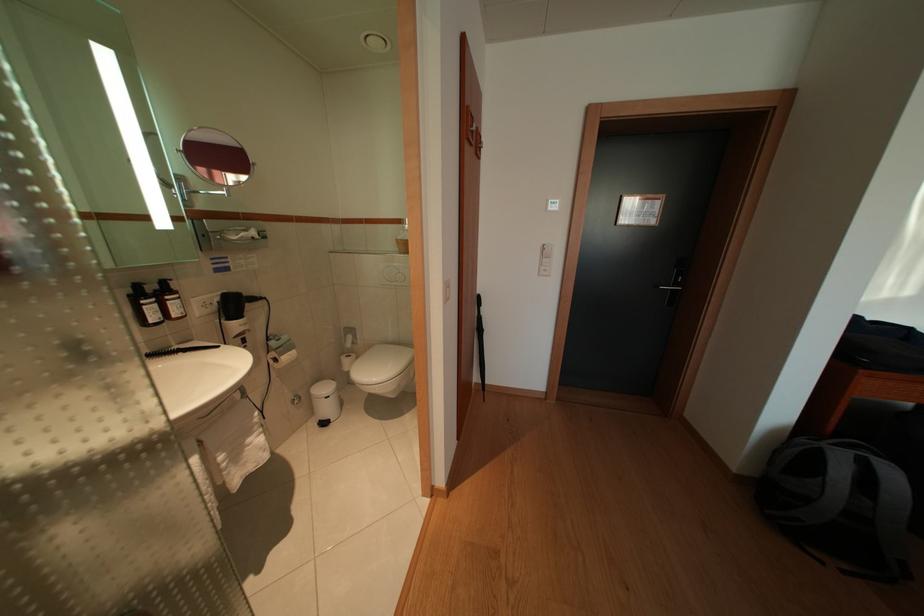
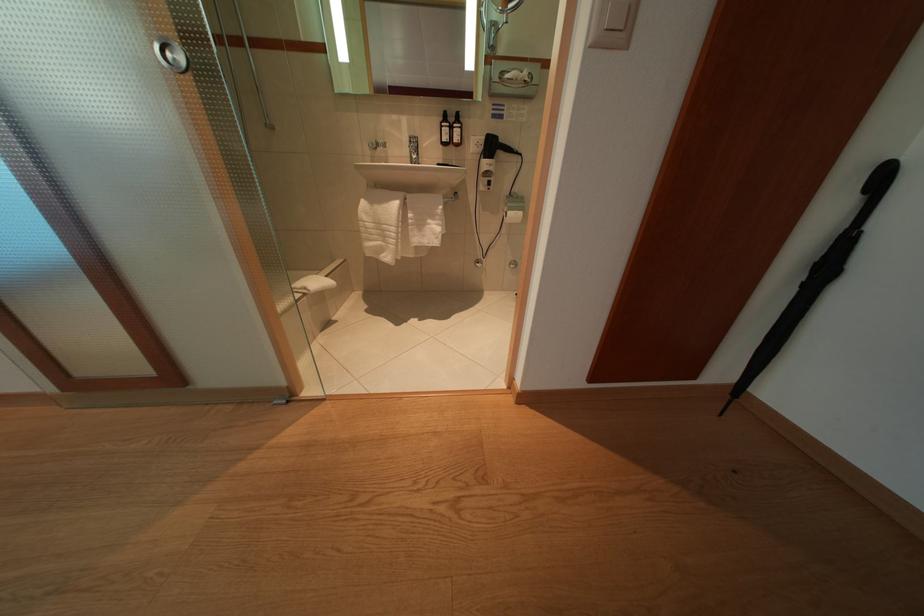
Locate, in the second image, the point that corresponds to [489,336] in the first image.

(834, 275)